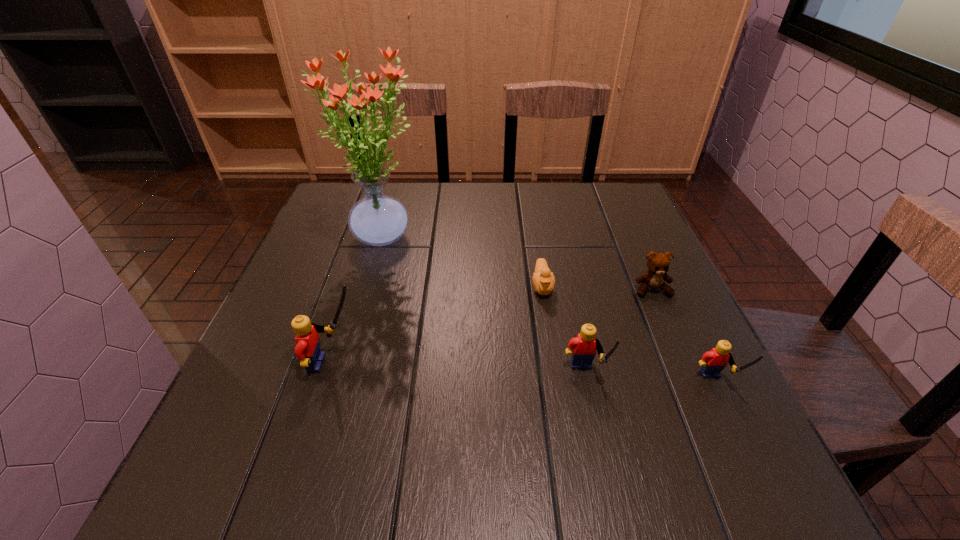
I want to click on vacant space that is in between the shortest object and the tallest object, so [x=462, y=261].

You are a GUI agent. You are given a task and a screenshot of the screen. Output one action in this format:
    pyautogui.click(x=<x>, y=<y>)
    Task: Click on the vacant space in between the leftmost Lego and the duckling
    
    Given the screenshot: What is the action you would take?
    pyautogui.click(x=438, y=325)

Identify the location of free space between the flower arrangement and the second shortest Lego. (483, 307).

You are a GUI agent. You are given a task and a screenshot of the screen. Output one action in this format:
    pyautogui.click(x=<x>, y=<y>)
    Task: Click on the free area in between the farthest object and the third tallest object
    
    Given the screenshot: What is the action you would take?
    pyautogui.click(x=483, y=307)

Locate an element on the screen. unoccupied area between the duckling and the second shortest object is located at coordinates tap(597, 288).

This screenshot has width=960, height=540. In order to click on vacant area between the third shortest object and the teddy bear in this screenshot , I will do point(684,338).

This screenshot has height=540, width=960. What are the coordinates of `empty space that is in between the shortest object and the rightmost Lego` in the screenshot? It's located at [629, 335].

Where is `free spot between the second tallest Lego and the duckling`? free spot between the second tallest Lego and the duckling is located at coordinates (564, 332).

This screenshot has height=540, width=960. I want to click on object identified as the third closest to the shortest object, so (377, 219).

Point out which object is positioned as the nearest to the second shortest Lego. Please provide its 2D coordinates. Your answer should be formatted as a tuple, i.e. [(x, y)], where the tuple contains the x and y coordinates of a point satisfying the conditions above.

[(543, 280)]